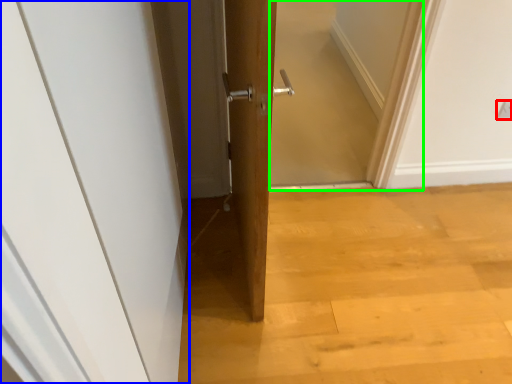
Question: Which is farther away from electric outlet (highlighted by a red box)? door (highlighted by a blue box) or screen door (highlighted by a green box)?

Choices:
 (A) door
 (B) screen door

Answer: (A)